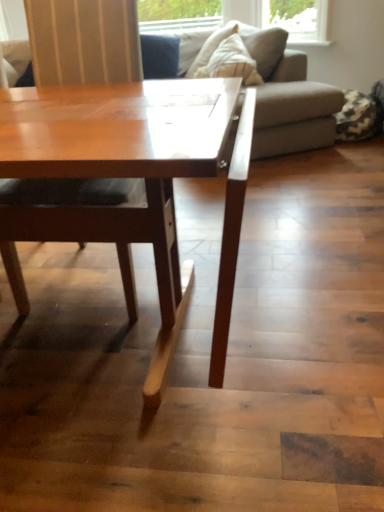
Image resolution: width=384 pixels, height=512 pixels. I want to click on free location to the right of matte wood chair at center, so click(235, 273).